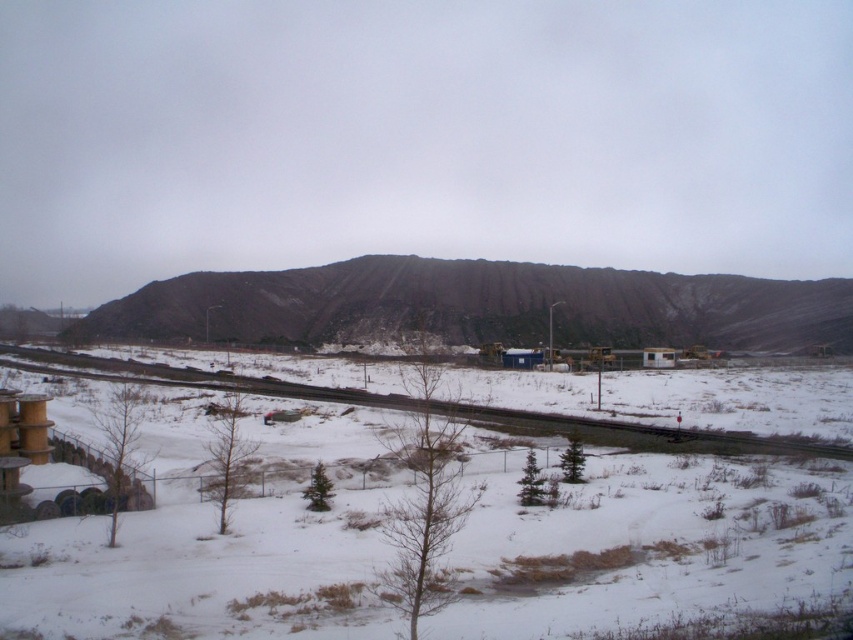
Question: Does brown/dirt-like mountain at center have a lesser width compared to snowy gravel train track at lower center?

Choices:
 (A) no
 (B) yes

Answer: (A)

Question: Which point is farther from the camera taking this photo?

Choices:
 (A) (297, 291)
 (B) (28, 618)
 (C) (756, 445)

Answer: (A)

Question: Does brown/dirt-like mountain at center appear on the left side of snowy gravel train track at lower center?

Choices:
 (A) yes
 (B) no

Answer: (B)

Question: In this image, where is white powdery snow at center located relative to brown/dirt-like mountain at center?

Choices:
 (A) right
 (B) left

Answer: (B)

Question: Which of these objects is positioned closest to the white powdery snow at center?

Choices:
 (A) snowy gravel train track at lower center
 (B) brown/dirt-like mountain at center

Answer: (A)

Question: Estimate the real-world distances between objects in this image. Which object is closer to the snowy gravel train track at lower center?

Choices:
 (A) white powdery snow at center
 (B) brown/dirt-like mountain at center

Answer: (A)